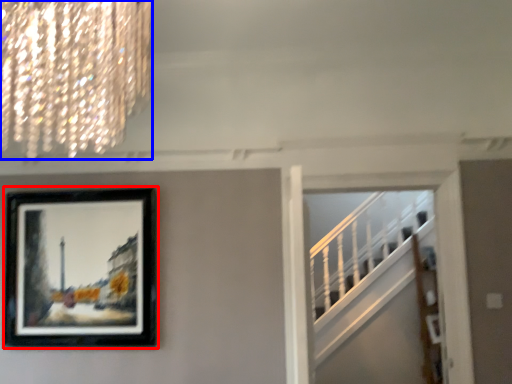
Question: Among these objects, which one is nearest to the camera, picture frame (highlighted by a red box) or lamp (highlighted by a blue box)?

Choices:
 (A) picture frame
 (B) lamp

Answer: (B)